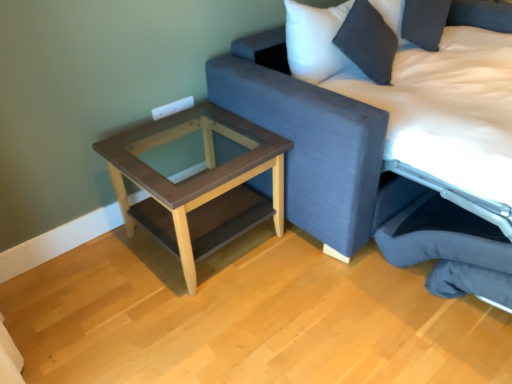
At what (x,y) coordinates should I click in order to perform the action: click on free space in front of brown wood table at lower left. Please return your answer as a coordinate pair (x, y). Looking at the image, I should click on (164, 337).